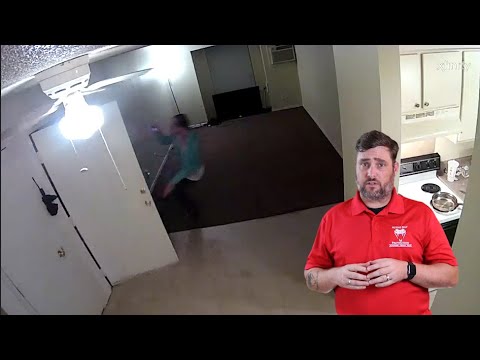
The image size is (480, 360). Identify the location of fan blade. (104, 82).